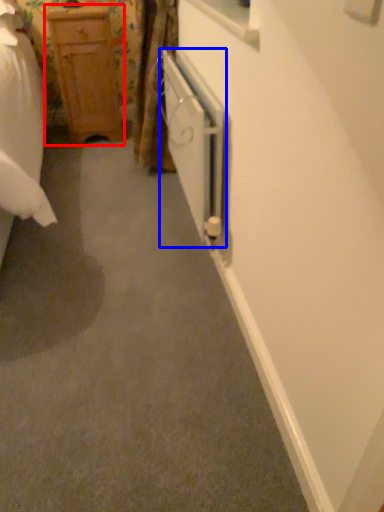
Question: Which object is closer to the camera taking this photo, chest of drawers (highlighted by a red box) or screen door (highlighted by a blue box)?

Choices:
 (A) chest of drawers
 (B) screen door

Answer: (B)